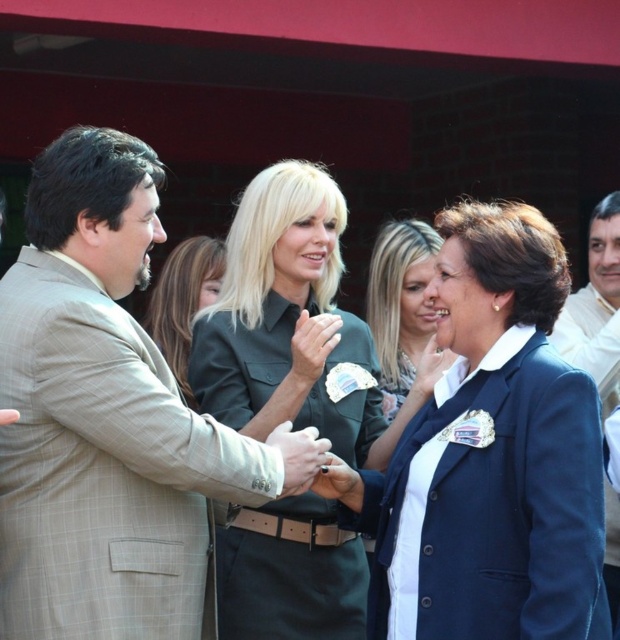
Can you confirm if blue fabric jacket at center is positioned above matte black shirt at center?

Yes, blue fabric jacket at center is above matte black shirt at center.

Which is more to the right, blue fabric jacket at center or matte black shirt at center?

Positioned to the right is blue fabric jacket at center.

Does point (420, 252) come closer to viewer compared to point (188, 264)?

Yes, point (420, 252) is closer to viewer.

Where is `blue fabric jacket at center`? This screenshot has width=620, height=640. blue fabric jacket at center is located at coordinates (403, 326).

The width and height of the screenshot is (620, 640). Describe the element at coordinates (595, 307) in the screenshot. I see `light brown suit at right` at that location.

Can you confirm if light brown suit at right is positioned to the left of matte black shirt at center?

No, light brown suit at right is not to the left of matte black shirt at center.

Describe the element at coordinates (595, 307) in the screenshot. The width and height of the screenshot is (620, 640). I see `light brown suit at right` at that location.

Locate an element on the screen. This screenshot has width=620, height=640. light brown suit at right is located at coordinates (595, 307).

Which is behind, point (422, 499) or point (262, 257)?

The point (262, 257) is more distant.

Which is more to the right, navy blue fabric business suit at center or green uniform at center?

Positioned to the right is navy blue fabric business suit at center.

Locate an element on the screen. This screenshot has height=640, width=620. navy blue fabric business suit at center is located at coordinates (492, 504).